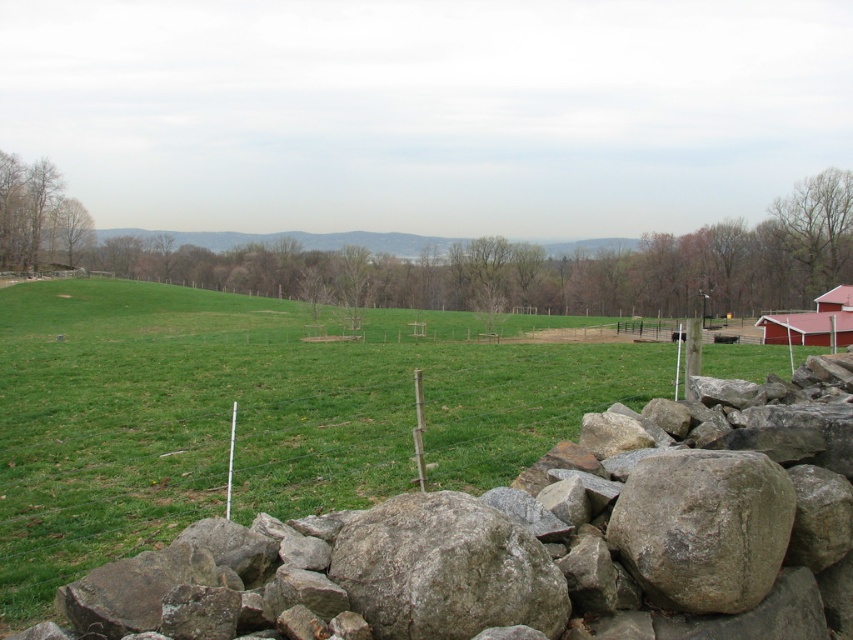
Does green grassy field at center have a greater width compared to red wooden barn at right?

Indeed, green grassy field at center has a greater width compared to red wooden barn at right.

Who is positioned more to the right, green grassy field at center or red wooden barn at right?

red wooden barn at right is more to the right.

Who is more forward, (32, 400) or (792, 324)?

Point (32, 400)

This screenshot has height=640, width=853. Identify the location of green grassy field at center. (241, 410).